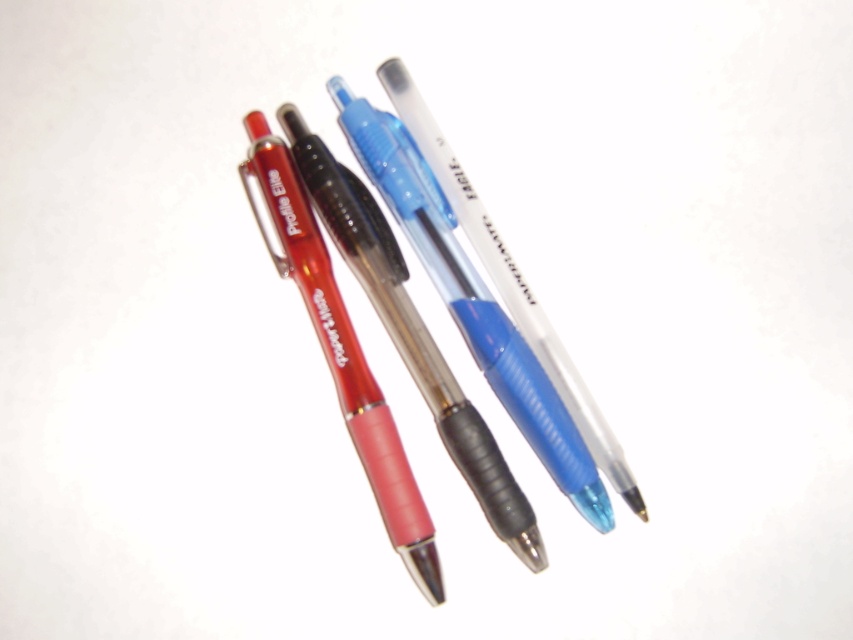
You are organizing pens on a shelf and need to know which is wider. Which is wider between the translucent plastic pen at center and the translucent plastic pen at upper left?

The translucent plastic pen at center is wider than the translucent plastic pen at upper left according to the description.

You are an office worker who needs to find the translucent plastic pen at center. The coordinate system has its origin at the bottom left corner of the image. Can you confirm if the point at coordinate [471,300] is the correct location for the translucent plastic pen at center?

Yes, the point at coordinate [471,300] corresponds to the translucent plastic pen at center as stated in the objects description.